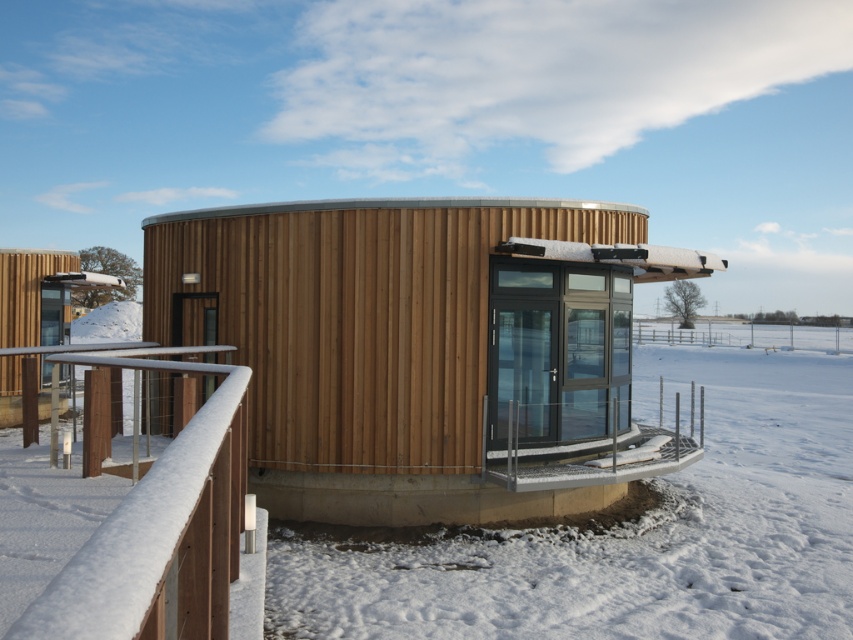
Can you confirm if white powdery snow at center is smaller than wooden at left?

No, white powdery snow at center is not smaller than wooden at left.

Is white powdery snow at center behind wooden at left?

Yes.

Locate an element on the screen. The image size is (853, 640). white powdery snow at center is located at coordinates (628, 528).

Locate an element on the screen. Image resolution: width=853 pixels, height=640 pixels. white powdery snow at center is located at coordinates (628, 528).